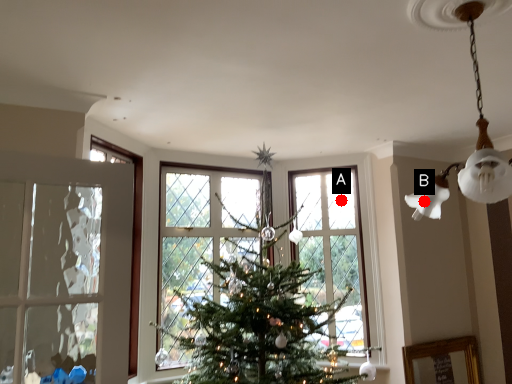
Question: Two points are circled on the image, labeled by A and B beside each circle. Which point appears farthest from the camera in this image?

Choices:
 (A) A is further
 (B) B is further

Answer: (A)